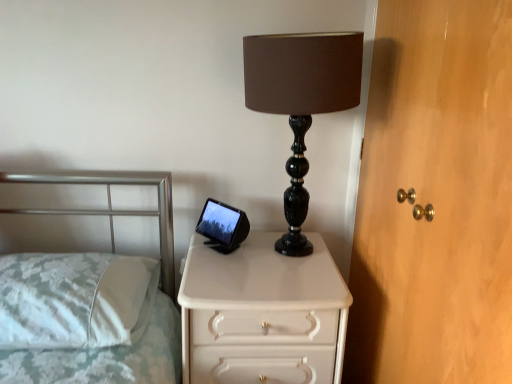
Question: Considering the relative sizes of white fabric pillow at left and wooden dresser at right in the image provided, is white fabric pillow at left shorter than wooden dresser at right?

Choices:
 (A) no
 (B) yes

Answer: (B)

Question: From a real-world perspective, does white fabric pillow at left sit lower than wooden dresser at right?

Choices:
 (A) no
 (B) yes

Answer: (B)

Question: Is white fabric pillow at left beside wooden dresser at right?

Choices:
 (A) no
 (B) yes

Answer: (A)

Question: Is white fabric pillow at left aimed at wooden dresser at right?

Choices:
 (A) yes
 (B) no

Answer: (B)

Question: Is white fabric pillow at left turned away from wooden dresser at right?

Choices:
 (A) yes
 (B) no

Answer: (B)

Question: Considering the relative positions of white fabric pillow at left and white glossy chest of drawers at center in the image provided, is white fabric pillow at left to the left or to the right of white glossy chest of drawers at center?

Choices:
 (A) left
 (B) right

Answer: (A)

Question: From a real-world perspective, relative to white glossy chest of drawers at center, is white fabric pillow at left vertically above or below?

Choices:
 (A) above
 (B) below

Answer: (A)

Question: From their relative heights in the image, would you say white fabric pillow at left is taller or shorter than white glossy chest of drawers at center?

Choices:
 (A) tall
 (B) short

Answer: (B)

Question: Considering the positions of white fabric pillow at left and white glossy chest of drawers at center in the image, is white fabric pillow at left bigger or smaller than white glossy chest of drawers at center?

Choices:
 (A) big
 (B) small

Answer: (B)

Question: From a real-world perspective, relative to white glossy chest of drawers at center, is wooden dresser at right vertically above or below?

Choices:
 (A) below
 (B) above

Answer: (B)

Question: In terms of width, does wooden dresser at right look wider or thinner when compared to white glossy chest of drawers at center?

Choices:
 (A) thin
 (B) wide

Answer: (A)

Question: Is point (437, 172) positioned closer to the camera than point (189, 360)?

Choices:
 (A) closer
 (B) farther

Answer: (A)

Question: Looking at the image, does wooden dresser at right seem bigger or smaller compared to white glossy chest of drawers at center?

Choices:
 (A) big
 (B) small

Answer: (B)

Question: In the image, is wooden dresser at right positioned in front of or behind black marble lamp at center?

Choices:
 (A) front
 (B) behind

Answer: (A)

Question: From a real-world perspective, is wooden dresser at right above or below black marble lamp at center?

Choices:
 (A) above
 (B) below

Answer: (B)